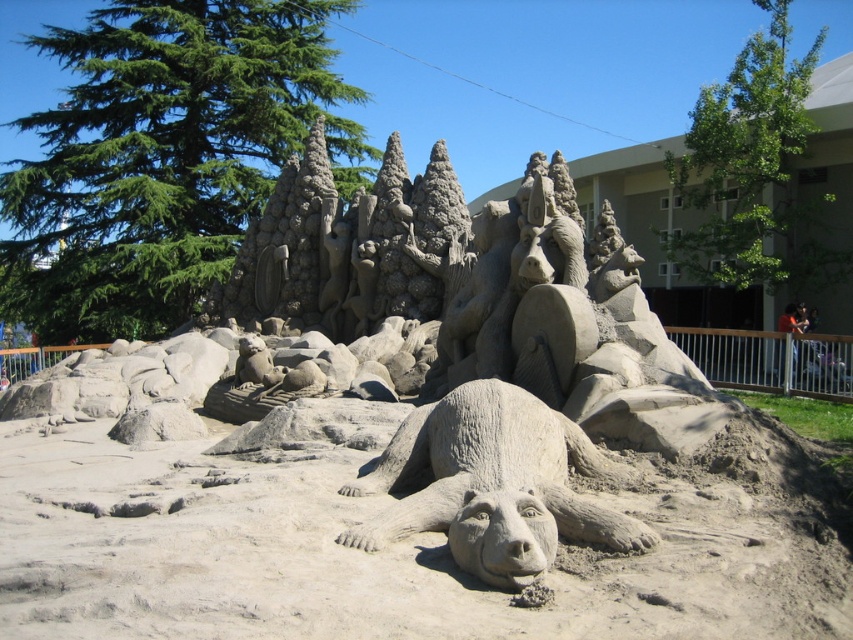
Question: Does gray sand sculpture at center have a lesser width compared to gray textured bear at center?

Choices:
 (A) yes
 (B) no

Answer: (A)

Question: Is green coniferous tree at upper left below gray textured bear at center?

Choices:
 (A) no
 (B) yes

Answer: (A)

Question: Which object appears closest to the camera in this image?

Choices:
 (A) gray sand sculpture at center
 (B) green coniferous tree at upper left

Answer: (A)

Question: Does green coniferous tree at upper left have a larger size compared to gray textured bear at center?

Choices:
 (A) no
 (B) yes

Answer: (B)

Question: Which of the following is the farthest from the observer?

Choices:
 (A) green coniferous tree at upper left
 (B) gray sand sculpture at center
 (C) gray textured bear at center

Answer: (A)

Question: Which of the following is the closest to the observer?

Choices:
 (A) (30, 586)
 (B) (595, 541)

Answer: (A)